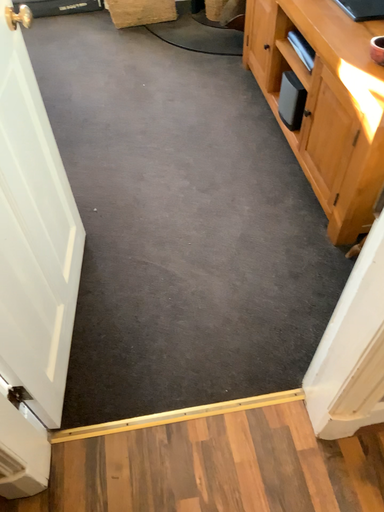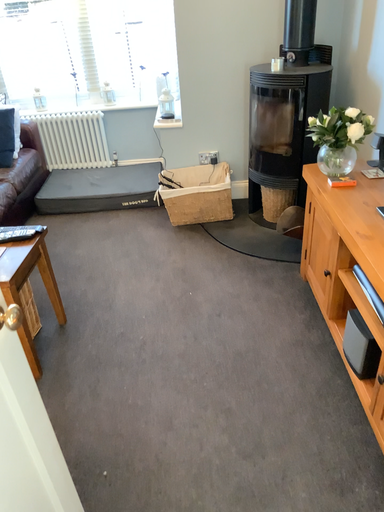
Question: How did the camera likely rotate when shooting the video?

Choices:
 (A) rotated right
 (B) rotated left

Answer: (B)